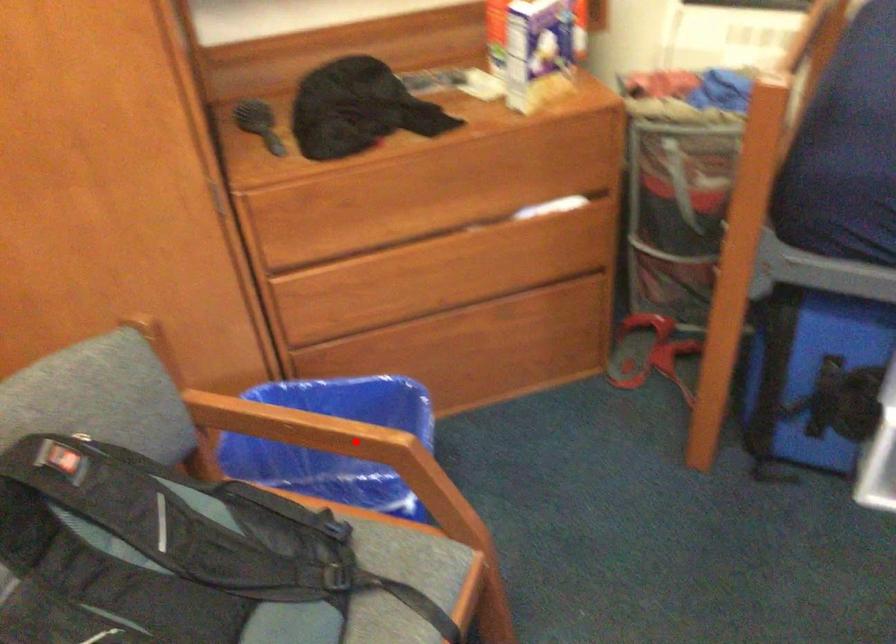
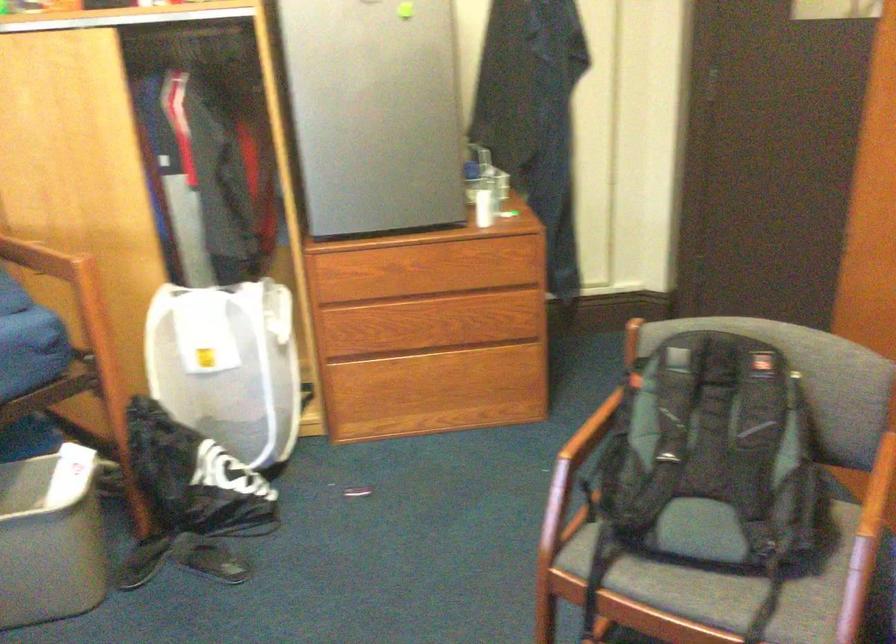
Locate, in the second image, the point that corresponds to the highlighted location in the first image.

(871, 520)